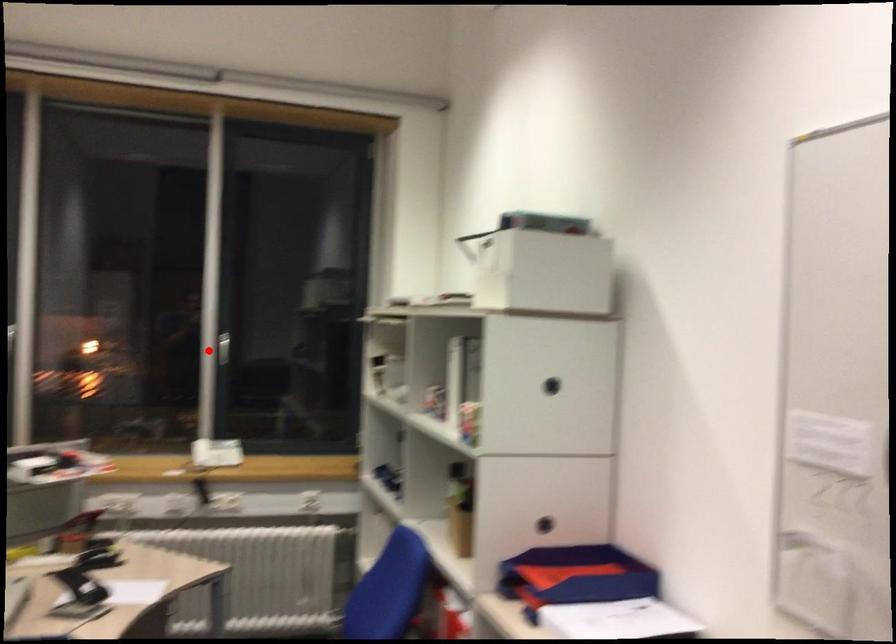
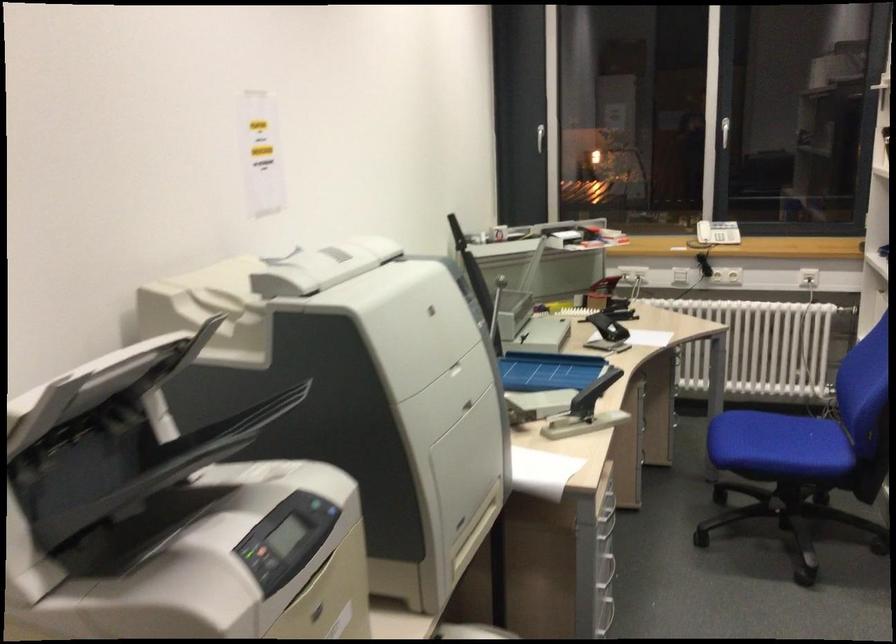
In the second image, find the point that corresponds to the highlighted location in the first image.

(721, 134)